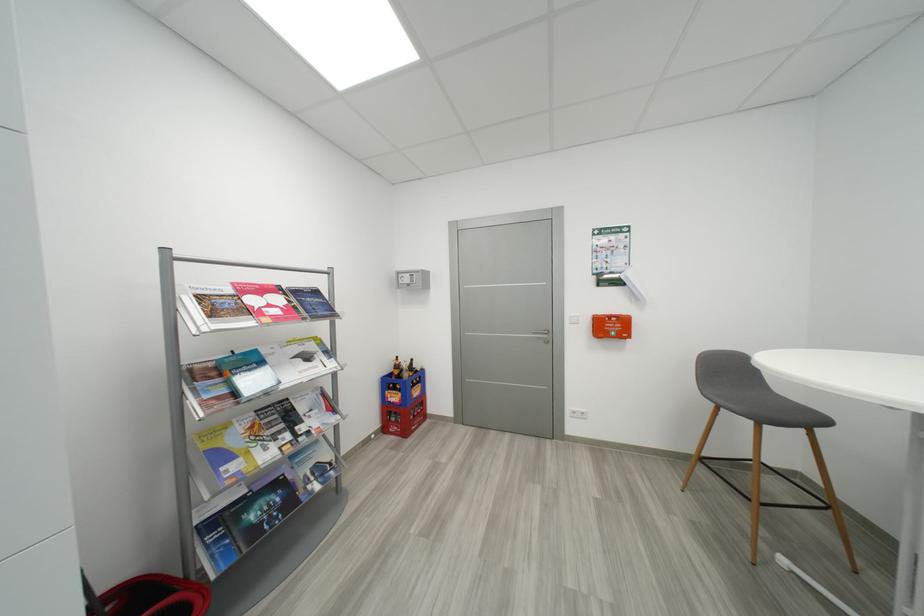
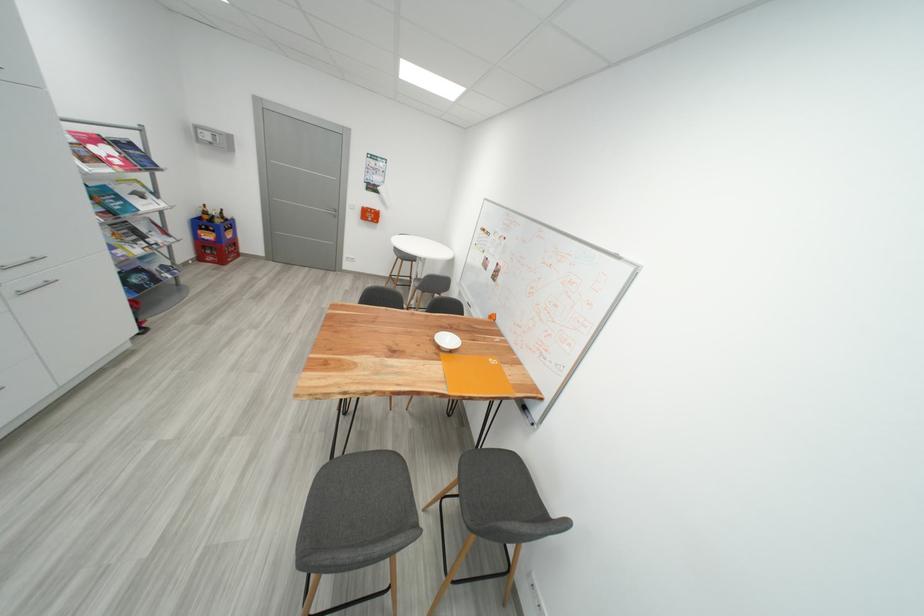
In the second image, find the point that corresponds to (x=412, y=377) in the first image.

(225, 223)